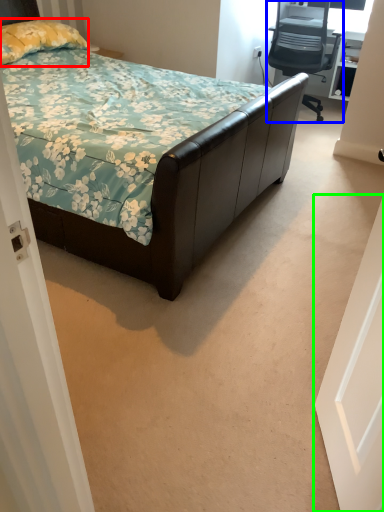
Question: Considering the real-world distances, which object is closest to pillow (highlighted by a red box)? chair (highlighted by a blue box) or door (highlighted by a green box).

Choices:
 (A) chair
 (B) door

Answer: (A)